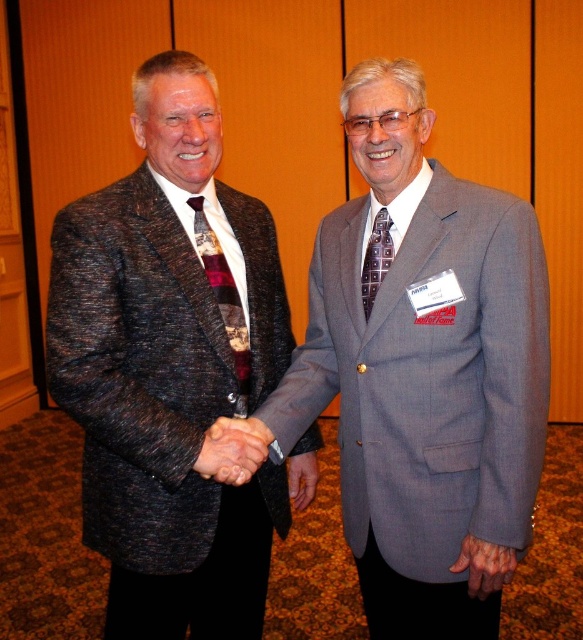
Question: Can you confirm if gray textured suit at center is wider than smooth skin hand at lower right?

Choices:
 (A) no
 (B) yes

Answer: (B)

Question: Is gray textured suit at center behind brown dotted tie at center?

Choices:
 (A) no
 (B) yes

Answer: (A)

Question: Which object is closer to the camera taking this photo?

Choices:
 (A) smooth skin hand at center
 (B) smooth skin hand at lower right
 (C) textured wool blazer at center
 (D) brown dotted tie at center

Answer: (B)

Question: Which object appears closest to the camera in this image?

Choices:
 (A) smooth skin hand at lower right
 (B) smooth leather hand at center
 (C) textured wool blazer at center
 (D) plaid fabric tie at center

Answer: (A)

Question: Which object is positioned closest to the textured wool blazer at center?

Choices:
 (A) plaid fabric tie at center
 (B) brown dotted tie at center
 (C) gray textured suit at center

Answer: (A)

Question: Is gray textured suit at center to the left of brown dotted tie at center from the viewer's perspective?

Choices:
 (A) no
 (B) yes

Answer: (A)